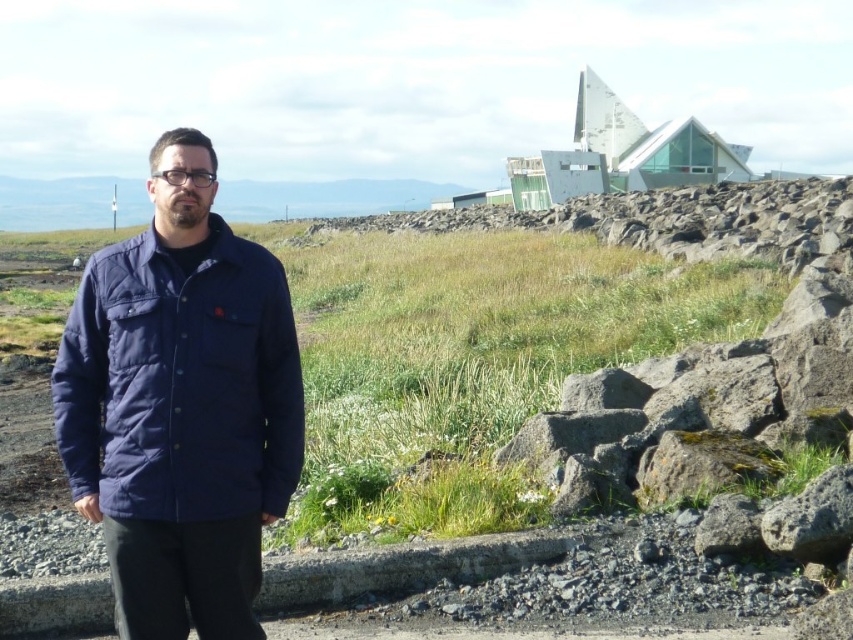
Can you confirm if gray rough rocks at center is positioned below navy blue quilted jacket at center?

Incorrect, gray rough rocks at center is not positioned below navy blue quilted jacket at center.

Who is more distant from viewer, (813, 356) or (254, 292)?

The point (813, 356) is more distant.

Identify the location of gray rough rocks at center. This screenshot has height=640, width=853. (589, 326).

Is navy blue quilted jacket at center closer to camera compared to gray rough rock at lower right?

Yes.

Between point (260, 289) and point (738, 531), which one is positioned behind?

Positioned behind is point (738, 531).

The width and height of the screenshot is (853, 640). Identify the location of navy blue quilted jacket at center. (181, 404).

Is point (840, 296) farther from camera compared to point (726, 536)?

Yes, point (840, 296) is farther from viewer.

Can you confirm if gray rough rocks at center is thinner than gray rough rock at lower right?

No, gray rough rocks at center is not thinner than gray rough rock at lower right.

This screenshot has width=853, height=640. What do you see at coordinates (589, 326) in the screenshot?
I see `gray rough rocks at center` at bounding box center [589, 326].

This screenshot has width=853, height=640. In order to click on gray rough rocks at center in this screenshot , I will do `click(589, 326)`.